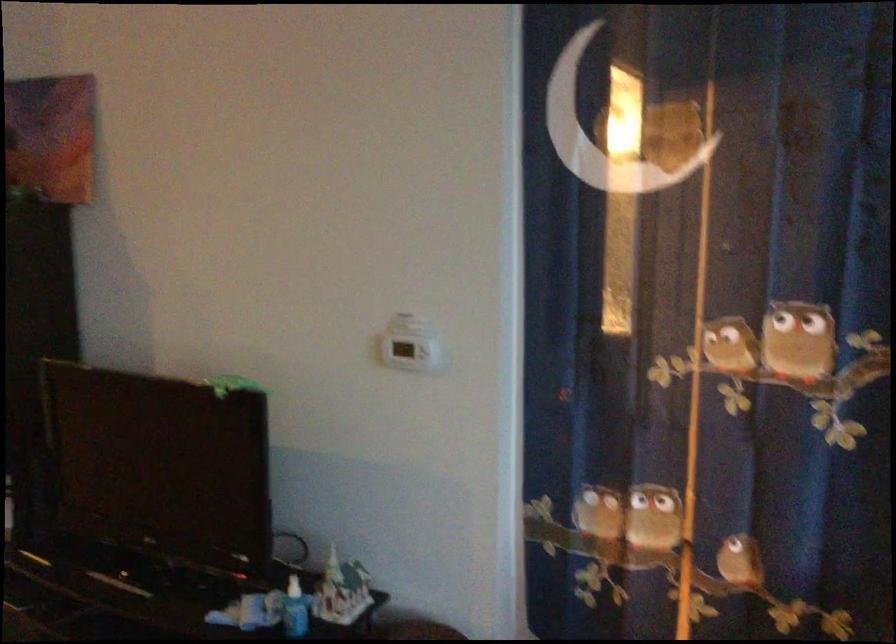
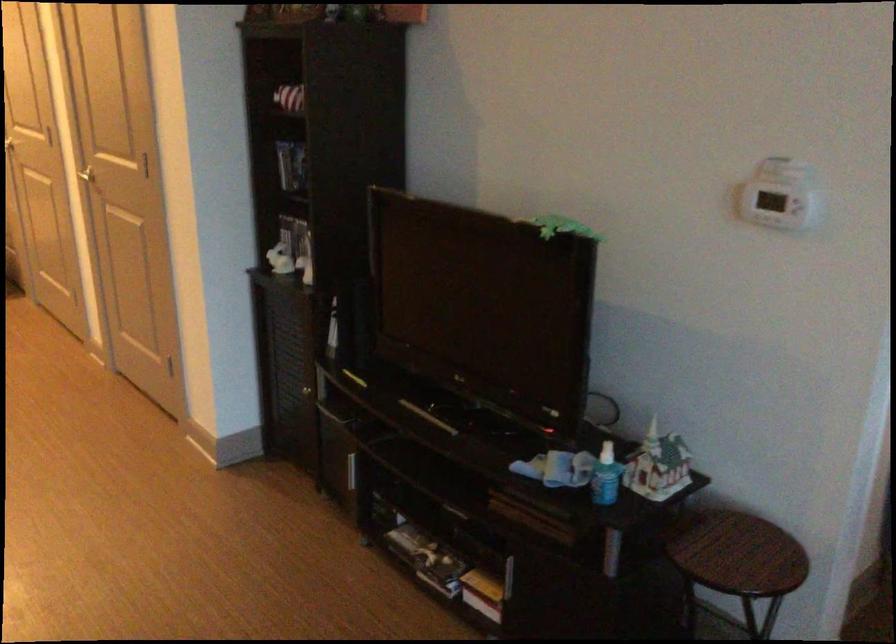
Question: The images are taken continuously from a first-person perspective. In which direction is your viewpoint rotating?

Choices:
 (A) Left
 (B) Right
 (C) Up
 (D) Down

Answer: (A)